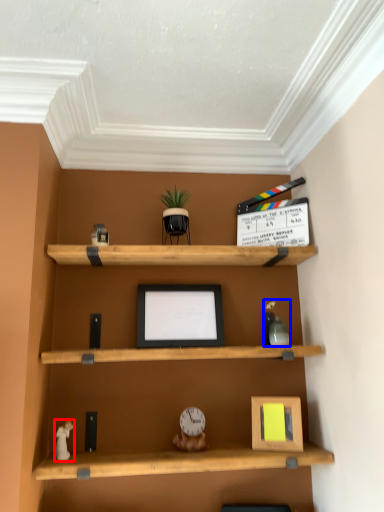
Question: Which point is further to the camera, toy (highlighted by a red box) or toy (highlighted by a blue box)?

Choices:
 (A) toy
 (B) toy

Answer: (B)